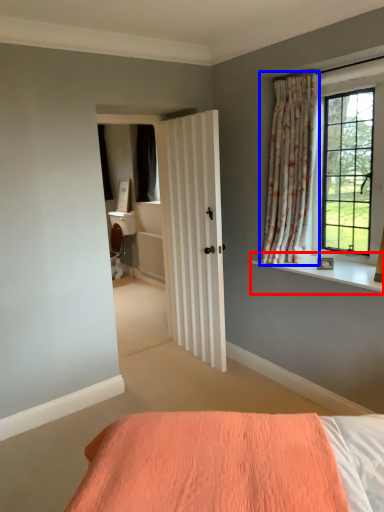
Question: Which of the following is the closest to the observer, window sill (highlighted by a red box) or curtain (highlighted by a blue box)?

Choices:
 (A) window sill
 (B) curtain

Answer: (A)